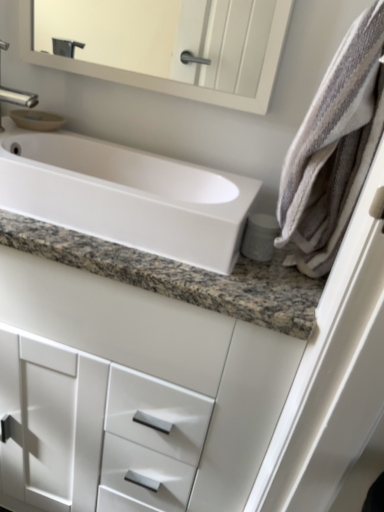
Where is `white glossy cabinet at center`? The width and height of the screenshot is (384, 512). white glossy cabinet at center is located at coordinates (132, 392).

The image size is (384, 512). Describe the element at coordinates (334, 148) in the screenshot. I see `striped cotton bath towel at right` at that location.

Locate an element on the screen. Image resolution: width=384 pixels, height=512 pixels. silver metallic faucet at upper left is located at coordinates (15, 90).

In the scene shown: Between striped cotton bath towel at right and white glossy sink at center, which one appears on the right side from the viewer's perspective?

From the viewer's perspective, striped cotton bath towel at right appears more on the right side.

Is striped cotton bath towel at right not close to white glossy sink at center?

Actually, striped cotton bath towel at right and white glossy sink at center are a little close together.

Is striped cotton bath towel at right closer to the viewer compared to white glossy sink at center?

Yes.

Would you consider silver metallic faucet at upper left to be distant from striped cotton bath towel at right?

No, silver metallic faucet at upper left is in close proximity to striped cotton bath towel at right.

Who is shorter, silver metallic faucet at upper left or striped cotton bath towel at right?

silver metallic faucet at upper left.

How distant is silver metallic faucet at upper left from striped cotton bath towel at right?

silver metallic faucet at upper left and striped cotton bath towel at right are 26.93 inches apart.

Does silver metallic faucet at upper left come behind striped cotton bath towel at right?

Yes, silver metallic faucet at upper left is further from the viewer.

From a real-world perspective, which is physically above, striped cotton bath towel at right or silver metallic faucet at upper left?

In real-world perspective, striped cotton bath towel at right is above.

In order to click on bath towel located above the silver metallic faucet at upper left (from a real-world perspective) in this screenshot , I will do `click(334, 148)`.

Is striped cotton bath towel at right turned away from silver metallic faucet at upper left?

No, striped cotton bath towel at right's orientation is not away from silver metallic faucet at upper left.

Considering their positions, is striped cotton bath towel at right located in front of or behind silver metallic faucet at upper left?

In the image, striped cotton bath towel at right appears in front of silver metallic faucet at upper left.

Which of these two, white glossy sink at center or white glossy cabinet at center, is thinner?

Thinner between the two is white glossy sink at center.

From the image's perspective, relative to white glossy cabinet at center, is white glossy sink at center above or below?

Clearly, from the image's perspective, white glossy sink at center is above white glossy cabinet at center.

Locate an element on the screen. This screenshot has width=384, height=512. sink above the white glossy cabinet at center (from the image's perspective) is located at coordinates (127, 196).

Considering the sizes of objects white glossy sink at center and white glossy cabinet at center in the image provided, who is smaller, white glossy sink at center or white glossy cabinet at center?

Smaller between the two is white glossy sink at center.

Where is `sink on the left of the striped cotton bath towel at right`? sink on the left of the striped cotton bath towel at right is located at coordinates (127, 196).

Can you tell me how much white glossy sink at center and striped cotton bath towel at right differ in facing direction?

white glossy sink at center and striped cotton bath towel at right are facing 0.799 degrees away from each other.

Considering the positions of points (34, 195) and (336, 76), is point (34, 195) farther from camera compared to point (336, 76)?

Yes, it is.

Which object is further away from the camera taking this photo, white glossy sink at center or striped cotton bath towel at right?

white glossy sink at center.

Is white glossy cabinet at center closer to camera compared to silver metallic faucet at upper left?

Yes, it is.

Considering the sizes of white glossy cabinet at center and silver metallic faucet at upper left in the image, is white glossy cabinet at center bigger or smaller than silver metallic faucet at upper left?

Considering their sizes, white glossy cabinet at center takes up more space than silver metallic faucet at upper left.

Is point (17, 347) positioned after point (20, 94)?

No, (17, 347) is in front of (20, 94).

Can you confirm if white glossy cabinet at center is thinner than silver metallic faucet at upper left?

No.

Is white glossy cabinet at center with white glossy sink at center?

white glossy cabinet at center is not next to white glossy sink at center, and they're not touching.

Considering the sizes of objects white glossy cabinet at center and white glossy sink at center in the image provided, who is taller, white glossy cabinet at center or white glossy sink at center?

white glossy cabinet at center.

How different are the orientations of white glossy cabinet at center and white glossy sink at center in degrees?

There is a 0.000355-degree angle between the facing directions of white glossy cabinet at center and white glossy sink at center.

Identify the location of sink below the striped cotton bath towel at right (from a real-world perspective). (127, 196).

Locate an element on the screen. Image resolution: width=384 pixels, height=512 pixels. bath towel that is above the silver metallic faucet at upper left (from a real-world perspective) is located at coordinates (334, 148).

Based on their spatial positions, is white glossy sink at center or white glossy cabinet at center further from striped cotton bath towel at right?

white glossy cabinet at center.

Looking at the image, which one is located further to white glossy sink at center, white glossy cabinet at center or silver metallic faucet at upper left?

silver metallic faucet at upper left lies further to white glossy sink at center than the other object.

Looking at the image, which one is located closer to striped cotton bath towel at right, white glossy cabinet at center or silver metallic faucet at upper left?

white glossy cabinet at center is closer to striped cotton bath towel at right.

Which object lies further to the anchor point white glossy cabinet at center, silver metallic faucet at upper left or striped cotton bath towel at right?

silver metallic faucet at upper left is further to white glossy cabinet at center.

When comparing their distances from white glossy sink at center, does white glossy cabinet at center or striped cotton bath towel at right seem further?

white glossy cabinet at center is positioned further to the anchor white glossy sink at center.

Looking at this image, estimate the real-world distances between objects in this image. Which object is further from white glossy cabinet at center, striped cotton bath towel at right or silver metallic faucet at upper left?

Among the two, silver metallic faucet at upper left is located further to white glossy cabinet at center.

Looking at the image, which one is located further to silver metallic faucet at upper left, white glossy sink at center or striped cotton bath towel at right?

striped cotton bath towel at right is positioned further to the anchor silver metallic faucet at upper left.

Considering their positions, is white glossy sink at center positioned closer to striped cotton bath towel at right than silver metallic faucet at upper left?

white glossy sink at center is closer to striped cotton bath towel at right.

You are a GUI agent. You are given a task and a screenshot of the screen. Output one action in this format:
    pyautogui.click(x=<x>, y=<y>)
    Task: Click on the sink between silver metallic faucet at upper left and white glossy cabinet at center in the vertical direction
    This screenshot has width=384, height=512.
    Given the screenshot: What is the action you would take?
    pyautogui.click(x=127, y=196)

The height and width of the screenshot is (512, 384). Find the location of `sink between silver metallic faucet at upper left and striped cotton bath towel at right from left to right`. sink between silver metallic faucet at upper left and striped cotton bath towel at right from left to right is located at coordinates (127, 196).

Identify the location of sink between striped cotton bath towel at right and white glossy cabinet at center in the vertical direction. (127, 196).

Identify the location of bath towel between silver metallic faucet at upper left and white glossy cabinet at center in the up-down direction. The image size is (384, 512). (334, 148).